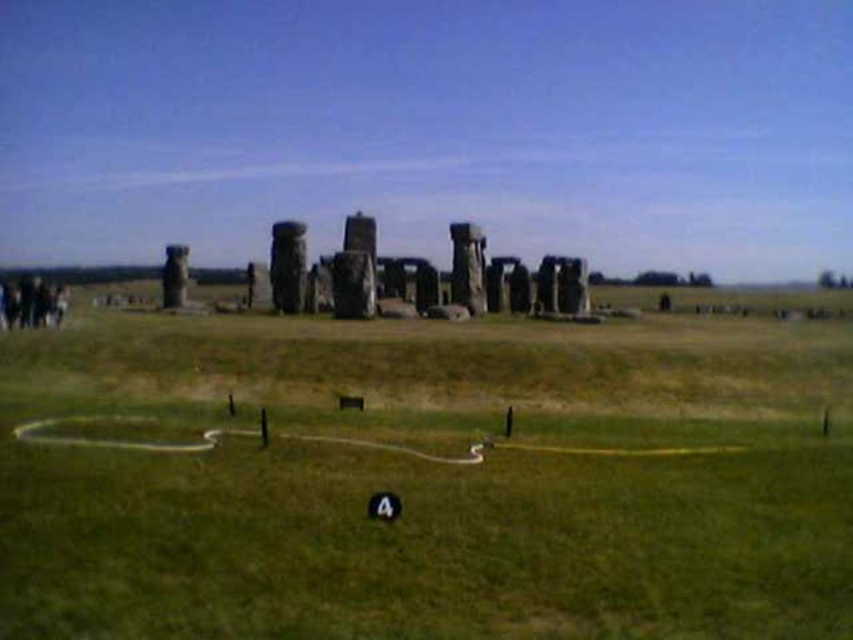
You are standing at the dark brown hair at lower left and want to walk to the green grassy field at center. Which direction should you head?

The green grassy field at center is to the right of dark brown hair at lower left, so you should head to the right.

You are standing at the edge of the green grassy field at center and want to walk to the smooth gray stone monument at left. Which direction should you walk to reach it?

The smooth gray stone monument at left is located to your left side, so you should walk towards your left to reach it.

You are planning to set up a small tent in the green grassy field at center. Considering the space available, will the smooth gray stone monument at left block your view of the surrounding landscape?

The green grassy field at center might be wider than smooth gray stone monument at left, so there is a possibility that the monument won not block your view. However, the exact width difference isn not specified, so it is uncertain.